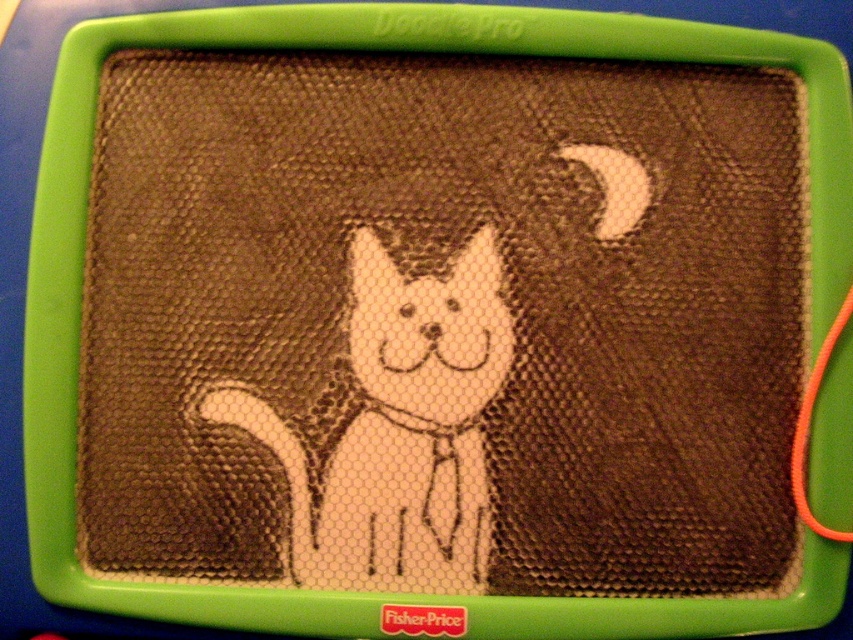
Question: Can you confirm if brown textured screen at center is thinner than white paper cat at center?

Choices:
 (A) no
 (B) yes

Answer: (A)

Question: Does brown textured screen at center have a lesser width compared to white paper cat at center?

Choices:
 (A) yes
 (B) no

Answer: (B)

Question: Among these objects, which one is farthest from the camera?

Choices:
 (A) white paper cat at center
 (B) brown textured screen at center

Answer: (A)

Question: Which point appears closest to the camera in this image?

Choices:
 (A) (413, 323)
 (B) (351, 499)

Answer: (B)

Question: Is brown textured screen at center behind white paper cat at center?

Choices:
 (A) yes
 (B) no

Answer: (B)